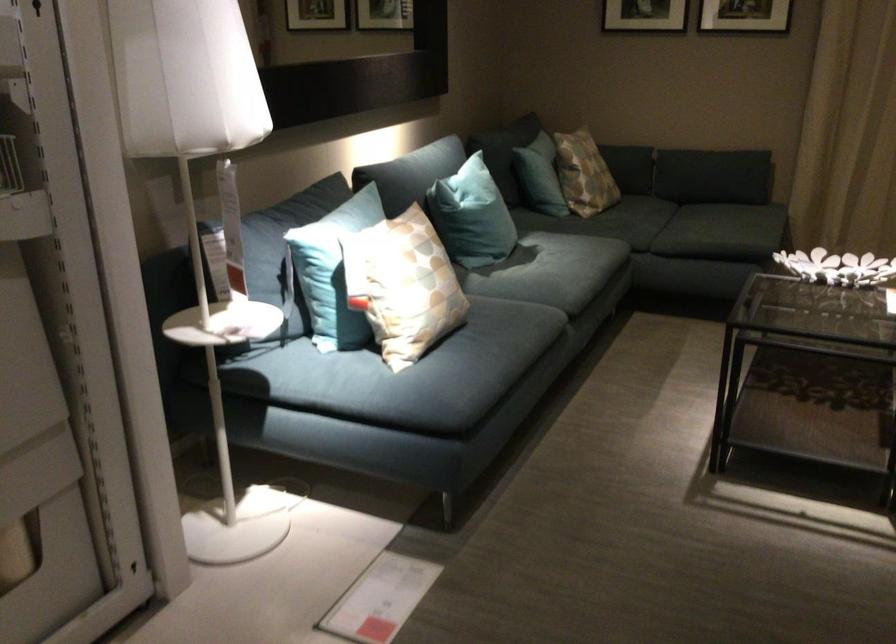
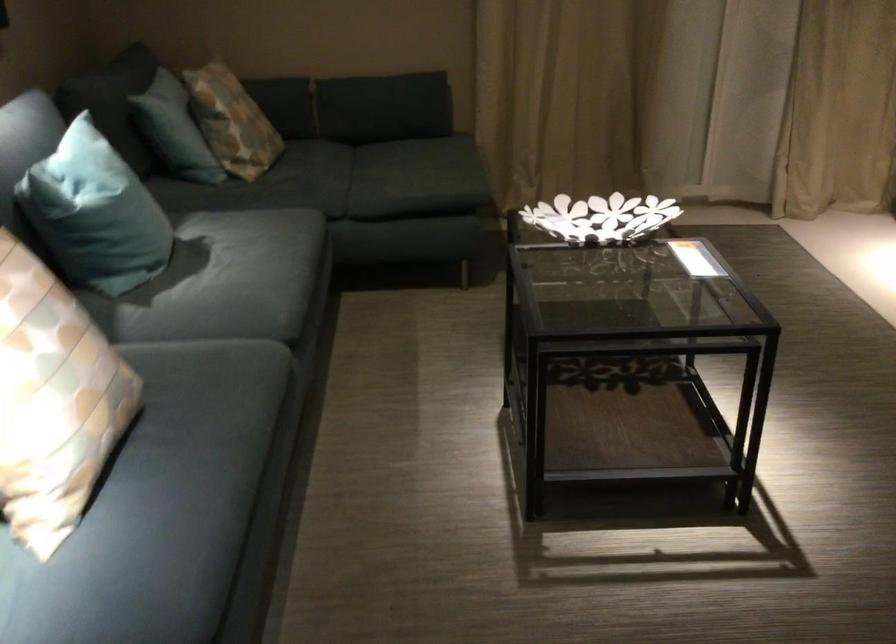
Question: Which direction would the cameraman need to move to produce the second image? Reply with the corresponding letter.

Choices:
 (A) Left
 (B) Right
 (C) Forward
 (D) Backward

Answer: (C)